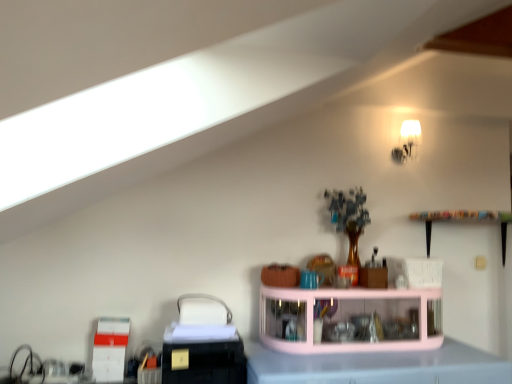
Question: Is white frosted glass lampshade at upper right located within pink glossy counter top at center?

Choices:
 (A) no
 (B) yes

Answer: (A)

Question: Considering the relative positions of pink glossy counter top at center and white frosted glass lampshade at upper right in the image provided, is pink glossy counter top at center behind white frosted glass lampshade at upper right?

Choices:
 (A) no
 (B) yes

Answer: (A)

Question: From a real-world perspective, is pink glossy counter top at center physically below white frosted glass lampshade at upper right?

Choices:
 (A) no
 (B) yes

Answer: (B)

Question: Does pink glossy counter top at center have a lesser height compared to white frosted glass lampshade at upper right?

Choices:
 (A) no
 (B) yes

Answer: (A)

Question: Is pink glossy counter top at center far away from white frosted glass lampshade at upper right?

Choices:
 (A) no
 (B) yes

Answer: (B)

Question: Is pink glossy counter top at center closer to camera compared to white frosted glass lampshade at upper right?

Choices:
 (A) no
 (B) yes

Answer: (B)

Question: Can you confirm if pink glossy counter top at center is positioned to the left of pink glass shelf at center?

Choices:
 (A) no
 (B) yes

Answer: (A)

Question: From the image's perspective, is pink glossy counter top at center above pink glass shelf at center?

Choices:
 (A) no
 (B) yes

Answer: (A)

Question: From a real-world perspective, is pink glossy counter top at center physically below pink glass shelf at center?

Choices:
 (A) no
 (B) yes

Answer: (B)

Question: Considering the relative positions of pink glossy counter top at center and pink glass shelf at center in the image provided, is pink glossy counter top at center behind pink glass shelf at center?

Choices:
 (A) yes
 (B) no

Answer: (B)

Question: Considering the relative positions of pink glossy counter top at center and pink glass shelf at center in the image provided, is pink glossy counter top at center in front of pink glass shelf at center?

Choices:
 (A) yes
 (B) no

Answer: (A)

Question: Is pink glass shelf at center at the back of pink glossy counter top at center?

Choices:
 (A) yes
 (B) no

Answer: (B)

Question: Does white frosted glass lampshade at upper right have a larger size compared to pink glossy counter top at center?

Choices:
 (A) yes
 (B) no

Answer: (B)